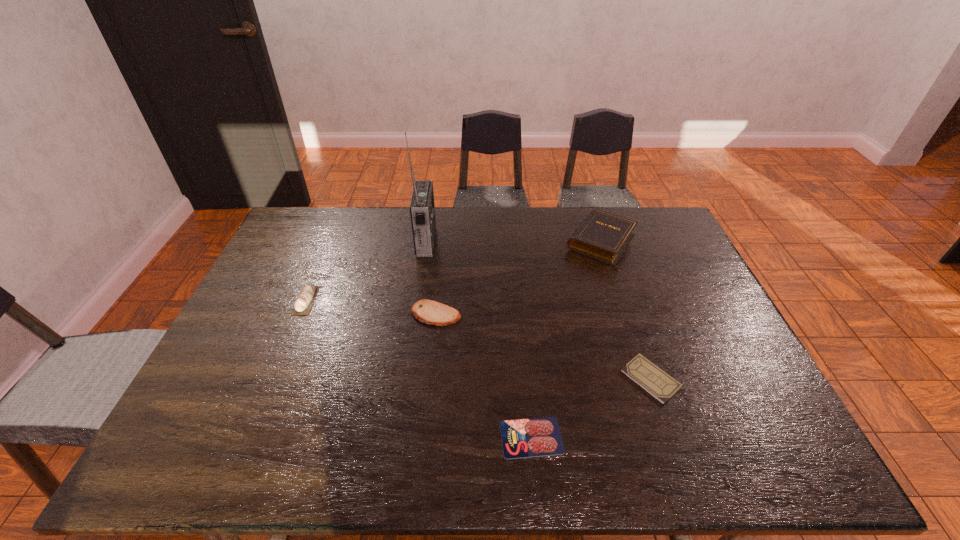
Find the location of `vacant space that satisfies the following two spatial constraints: 1. on the display of the shortest object; 2. on the right side of the radio receiver`. vacant space that satisfies the following two spatial constraints: 1. on the display of the shortest object; 2. on the right side of the radio receiver is located at coordinates 396,437.

The height and width of the screenshot is (540, 960). In order to click on free space that satisfies the following two spatial constraints: 1. on the display of the tallest object; 2. on the right side of the shortest object in this screenshot , I will do `click(396, 437)`.

I want to click on free space in the image that satisfies the following two spatial constraints: 1. on the front side of the salami; 2. on the right side of the shorter pita bread, so click(x=423, y=437).

Image resolution: width=960 pixels, height=540 pixels. In order to click on vacant area in the image that satisfies the following two spatial constraints: 1. on the display of the radio receiver; 2. on the right side of the right pita bread in this screenshot , I will do `click(416, 314)`.

I want to click on free space that satisfies the following two spatial constraints: 1. on the display of the radio receiver; 2. on the back side of the checkbook, so click(406, 379).

Image resolution: width=960 pixels, height=540 pixels. I want to click on free spot that satisfies the following two spatial constraints: 1. on the front side of the taller pita bread; 2. on the left side of the checkbook, so click(x=274, y=379).

At what (x,y) coordinates should I click in order to perform the action: click on blank space that satisfies the following two spatial constraints: 1. on the back side of the third shortest object; 2. on the display of the radio receiver. Please return your answer as a coordinate pair (x, y). This screenshot has height=540, width=960. Looking at the image, I should click on (444, 241).